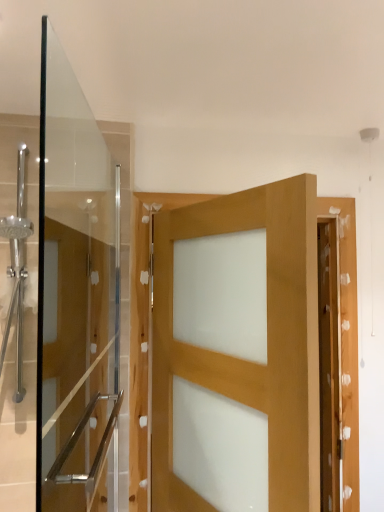
The width and height of the screenshot is (384, 512). Identify the location of clear glass door at left. click(76, 297).

What do you see at coordinates (76, 297) in the screenshot?
I see `clear glass door at left` at bounding box center [76, 297].

The image size is (384, 512). What are the coordinates of `natural wood door at center` in the screenshot? It's located at (268, 341).

The height and width of the screenshot is (512, 384). Describe the element at coordinates (268, 341) in the screenshot. I see `natural wood door at center` at that location.

I want to click on clear glass door at left, so click(x=76, y=297).

Which object is positioned more to the left, clear glass door at left or natural wood door at center?

Positioned to the left is clear glass door at left.

Considering the positions of objects clear glass door at left and natural wood door at center in the image provided, who is in front, clear glass door at left or natural wood door at center?

Positioned in front is clear glass door at left.

Does point (40, 136) lie behind point (260, 198)?

Yes, point (40, 136) is behind point (260, 198).

Based on the photo, from the image's perspective, does clear glass door at left appear lower than natural wood door at center?

No.

From a real-world perspective, is clear glass door at left above or below natural wood door at center?

From a real-world perspective, clear glass door at left is physically above natural wood door at center.

Considering the relative sizes of clear glass door at left and natural wood door at center in the image provided, is clear glass door at left wider than natural wood door at center?

No, clear glass door at left is not wider than natural wood door at center.

Between clear glass door at left and natural wood door at center, which one has more height?

clear glass door at left is taller.

Looking at this image, is clear glass door at left bigger than natural wood door at center?

Actually, clear glass door at left might be smaller than natural wood door at center.

Which is correct: clear glass door at left is inside natural wood door at center, or outside of it?

clear glass door at left lies outside natural wood door at center.

Looking at this image, is clear glass door at left next to natural wood door at center?

clear glass door at left and natural wood door at center are clearly separated.

Based on the photo, could you tell me if clear glass door at left is facing natural wood door at center?

Yes, clear glass door at left faces towards natural wood door at center.

What's the angular difference between clear glass door at left and natural wood door at center's facing directions?

The angle between the facing direction of clear glass door at left and the facing direction of natural wood door at center is 27.4 degrees.

Looking at this image, how much distance is there between clear glass door at left and natural wood door at center?

clear glass door at left and natural wood door at center are 15.65 inches apart from each other.

The width and height of the screenshot is (384, 512). Identify the location of door below the clear glass door at left (from the image's perspective). (268, 341).

Is natural wood door at center to the right of clear glass door at left from the viewer's perspective?

Correct, you'll find natural wood door at center to the right of clear glass door at left.

Based on the photo, is the position of natural wood door at center less distant than that of clear glass door at left?

No, the depth of natural wood door at center is greater than that of clear glass door at left.

Is point (176, 220) closer or farther from the camera than point (41, 165)?

Point (176, 220) is closer to the camera than point (41, 165).

From the image's perspective, does natural wood door at center appear lower than clear glass door at left?

Yes.

From a real-world perspective, is natural wood door at center above or below clear glass door at left?

In terms of real-world spatial position, natural wood door at center is below clear glass door at left.

Considering the sizes of natural wood door at center and clear glass door at left in the image, is natural wood door at center wider or thinner than clear glass door at left?

Clearly, natural wood door at center has more width compared to clear glass door at left.

Does natural wood door at center have a greater height compared to clear glass door at left?

No.

Considering the relative sizes of natural wood door at center and clear glass door at left in the image provided, is natural wood door at center smaller than clear glass door at left?

Actually, natural wood door at center might be larger than clear glass door at left.

Is clear glass door at left inside natural wood door at center?

No, clear glass door at left is not a part of natural wood door at center.

Is natural wood door at center next to clear glass door at left and touching it?

No, natural wood door at center is not in contact with clear glass door at left.

Is natural wood door at center turned away from clear glass door at left?

Yes, clear glass door at left is at the back of natural wood door at center.

Measure the distance between natural wood door at center and clear glass door at left.

The distance of natural wood door at center from clear glass door at left is 15.65 inches.

The height and width of the screenshot is (512, 384). I want to click on door below the clear glass door at left (from the image's perspective), so click(268, 341).

Where is `door on the right of clear glass door at left`? door on the right of clear glass door at left is located at coordinates (268, 341).

Image resolution: width=384 pixels, height=512 pixels. I want to click on door below the clear glass door at left (from a real-world perspective), so click(x=268, y=341).